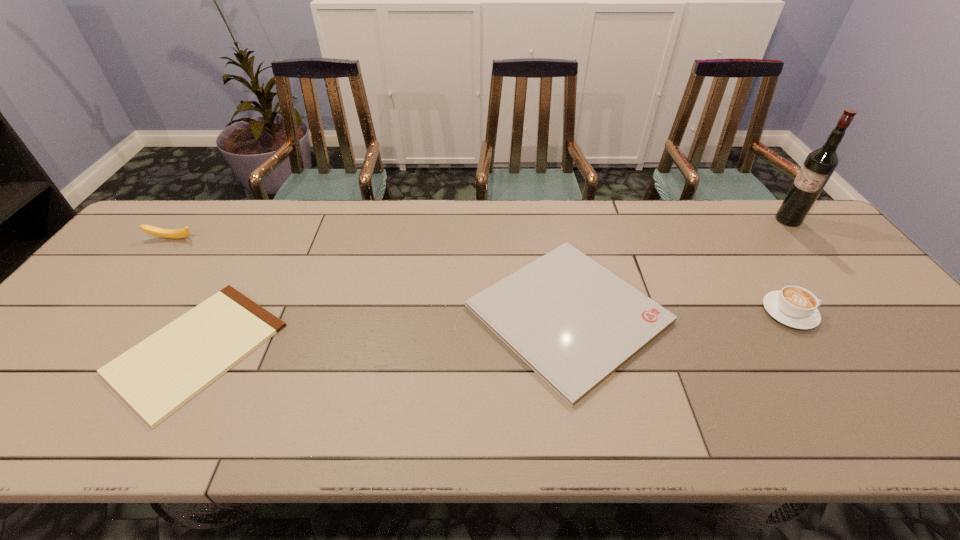
Locate an element on the screen. free space located on the front and back of the farthest object is located at coordinates 675,220.

This screenshot has height=540, width=960. Identify the location of free space located at the stem of the banana. (144, 275).

Find the location of a particular element. This screenshot has height=540, width=960. vacant space located 0.170m on the side of the second object from right to left with the handle is located at coordinates (881, 312).

The width and height of the screenshot is (960, 540). What are the coordinates of `blank area located 0.140m on the back of the second shortest object` in the screenshot? It's located at (550, 219).

Locate an element on the screen. This screenshot has height=540, width=960. vacant space positioned 0.120m on the back of the left clipboard is located at coordinates (249, 258).

The width and height of the screenshot is (960, 540). In order to click on wine bottle present at the far edge in this screenshot , I will do `click(818, 167)`.

Where is `banana located in the far edge section of the desktop`? banana located in the far edge section of the desktop is located at coordinates (x=160, y=232).

Locate an element on the screen. Image resolution: width=960 pixels, height=540 pixels. object that is at the left edge is located at coordinates (160, 232).

I want to click on object that is at the right edge, so click(818, 167).

Identify the location of object at the far left corner. (x=160, y=232).